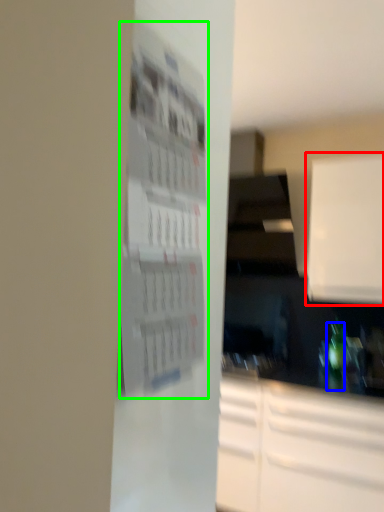
Question: Which is farther away from cabinetry (highlighted by a red box)? bottle (highlighted by a blue box) or bulletin board (highlighted by a green box)?

Choices:
 (A) bottle
 (B) bulletin board

Answer: (B)